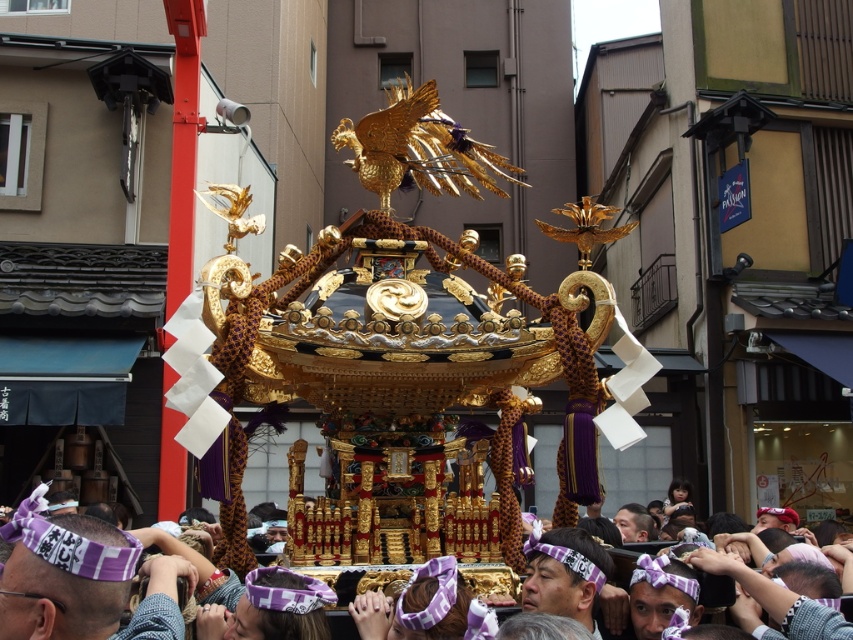
Question: Does gold ornate float at center appear on the left side of purple fabric headband at center?

Choices:
 (A) no
 (B) yes

Answer: (B)

Question: Which point appears farthest from the camera in this image?

Choices:
 (A) (572, 531)
 (B) (166, 536)

Answer: (B)

Question: Can you confirm if gold ornate float at center is thinner than purple fabric headband at center?

Choices:
 (A) no
 (B) yes

Answer: (A)

Question: Which object appears closest to the camera in this image?

Choices:
 (A) gold ornate float at center
 (B) purple fabric headband at center

Answer: (A)

Question: Is gold ornate float at center below purple fabric headband at center?

Choices:
 (A) yes
 (B) no

Answer: (B)

Question: Which object appears closest to the camera in this image?

Choices:
 (A) gold ornate float at center
 (B) purple fabric headband at center

Answer: (A)